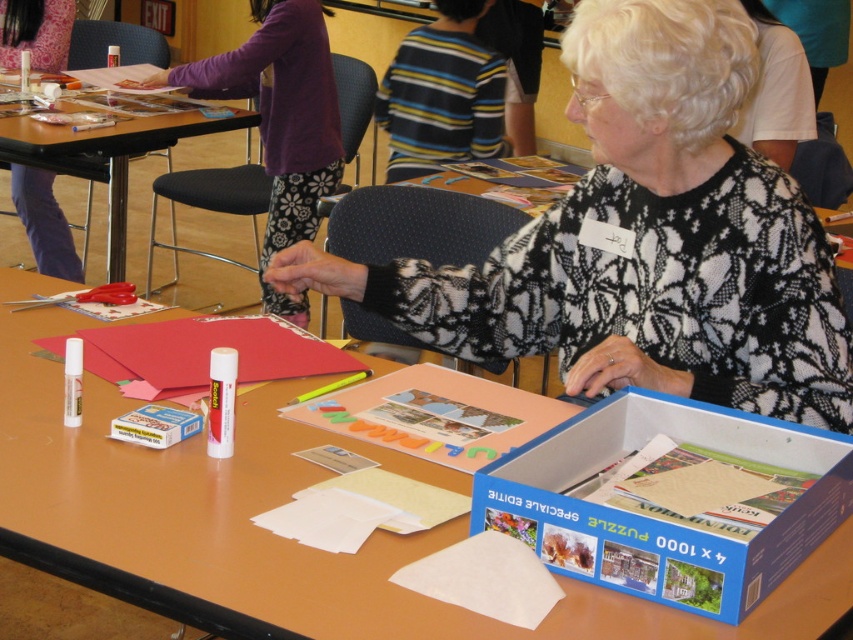
Question: Estimate the real-world distances between objects in this image. Which object is farther from the blue cardboard box at center?

Choices:
 (A) wooden table at center
 (B) purple fabric pants at upper left

Answer: (B)

Question: Which of the following is the closest to the observer?

Choices:
 (A) (94, 525)
 (B) (517, 504)

Answer: (B)

Question: Where is white lace sweater at center located in relation to wooden table at center in the image?

Choices:
 (A) below
 (B) above

Answer: (A)

Question: Considering the real-world distances, which object is farthest from the white lace sweater at center?

Choices:
 (A) smooth brown table at center
 (B) matte black scissors at left

Answer: (B)

Question: Can you confirm if wooden table at center is smaller than matte black scissors at left?

Choices:
 (A) yes
 (B) no

Answer: (B)

Question: Can you confirm if smooth brown table at center is bigger than matte black scissors at left?

Choices:
 (A) yes
 (B) no

Answer: (A)